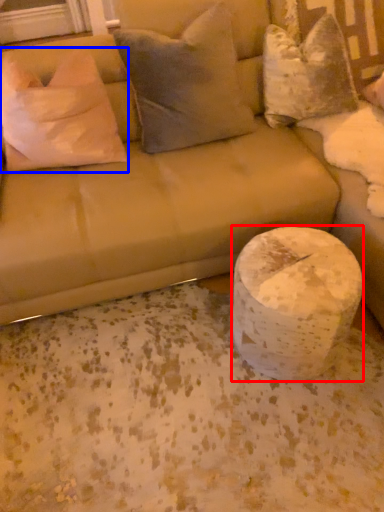
Question: Among these objects, which one is farthest to the camera, marble (highlighted by a red box) or pillow (highlighted by a blue box)?

Choices:
 (A) marble
 (B) pillow

Answer: (B)